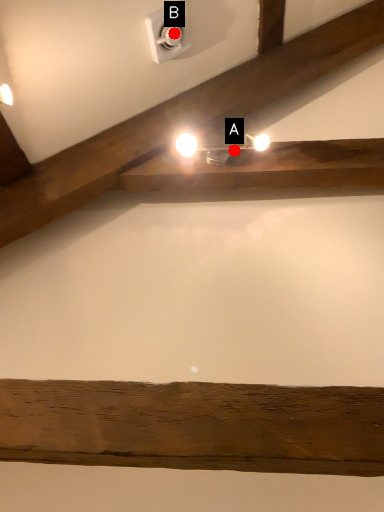
Question: Two points are circled on the image, labeled by A and B beside each circle. Which point is farther from the camera taking this photo?

Choices:
 (A) A is further
 (B) B is further

Answer: (B)